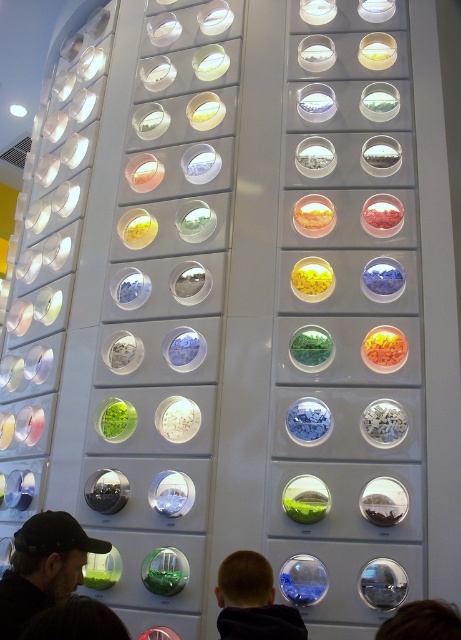
Looking at this image, is dark brown hair at lower left smaller than brown hair at lower right?

Yes, dark brown hair at lower left is smaller than brown hair at lower right.

Can you confirm if dark brown hair at lower left is positioned above brown hair at lower right?

Yes, dark brown hair at lower left is above brown hair at lower right.

What are the coordinates of `dark brown hair at lower left` in the screenshot? It's located at (76, 621).

Does dark brown leather cap at lower left come in front of dark brown hair at lower left?

No, dark brown leather cap at lower left is behind dark brown hair at lower left.

Between point (33, 576) and point (71, 628), which one is positioned behind?

The point (33, 576) is more distant.

This screenshot has height=640, width=461. Identify the location of dark brown leather cap at lower left. (42, 566).

Between dark brown leather cap at lower left and smooth blue shirt at center, which one appears on the left side from the viewer's perspective?

dark brown leather cap at lower left is more to the left.

Does dark brown leather cap at lower left appear under smooth blue shirt at center?

No.

Between point (11, 611) and point (226, 579), which one is positioned behind?

The point (226, 579) is behind.

Identify the location of dark brown leather cap at lower left. (42, 566).